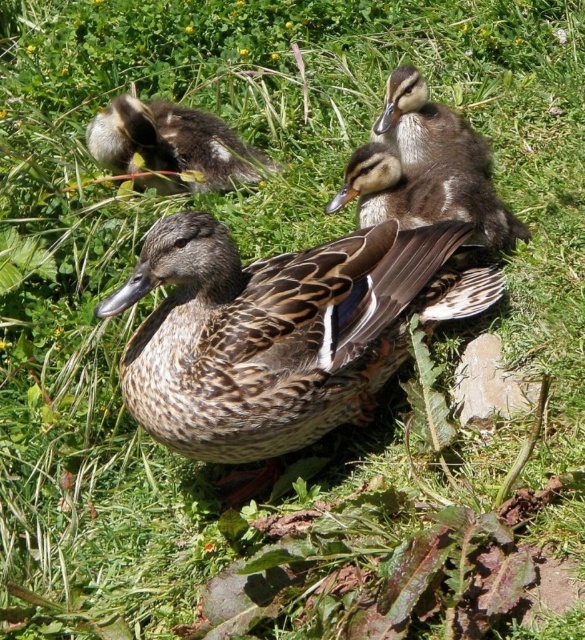
Is brown speckled duck at center above brown speckled duckling at center?

Actually, brown speckled duck at center is below brown speckled duckling at center.

Who is more forward, (408, 262) or (356, 192)?

Point (408, 262) is more forward.

Who is more distant from viewer, (335,388) or (433,192)?

Positioned behind is point (433,192).

Locate an element on the screen. This screenshot has height=640, width=585. brown speckled duck at center is located at coordinates (280, 333).

Does brown speckled duck at center have a greater height compared to brown fuzzy duckling at upper left?

Indeed, brown speckled duck at center has a greater height compared to brown fuzzy duckling at upper left.

Does point (161, 342) come farther from viewer compared to point (263, 170)?

No, it is in front of (263, 170).

The image size is (585, 640). I want to click on brown speckled duck at center, so click(280, 333).

This screenshot has height=640, width=585. What are the coordinates of `brown speckled duck at center` in the screenshot? It's located at (280, 333).

Is point (397, 314) positioned behind point (452, 109)?

No, (397, 314) is closer to viewer.

Is brown speckled duck at center below brown speckled duckling at upper center?

Yes, brown speckled duck at center is below brown speckled duckling at upper center.

Which is in front, point (187, 234) or point (486, 147)?

Point (187, 234) is more forward.

The image size is (585, 640). Identify the location of brown speckled duck at center. (280, 333).